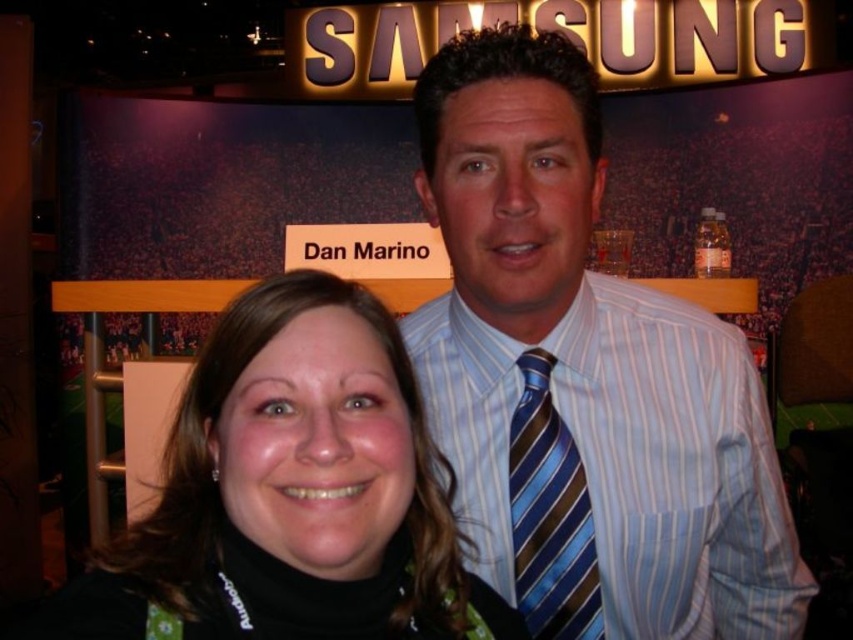
Who is more distant from viewer, (302,292) or (521,433)?

The point (521,433) is behind.

Where is `black matte hair at center`? Image resolution: width=853 pixels, height=640 pixels. black matte hair at center is located at coordinates (293, 492).

What are the coordinates of `black matte hair at center` in the screenshot? It's located at (293, 492).

Is blue striped shirt at center to the left of black matte hair at center from the viewer's perspective?

In fact, blue striped shirt at center is to the right of black matte hair at center.

Does blue striped shirt at center have a larger size compared to black matte hair at center?

Correct, blue striped shirt at center is larger in size than black matte hair at center.

Between point (724, 442) and point (403, 529), which one is positioned behind?

The point (724, 442) is more distant.

You are a GUI agent. You are given a task and a screenshot of the screen. Output one action in this format:
    pyautogui.click(x=<x>, y=<y>)
    Task: Click on the blue striped shirt at center
    The height and width of the screenshot is (640, 853).
    Given the screenshot: What is the action you would take?
    pyautogui.click(x=583, y=378)

Which of these two, blue striped shirt at center or blue striped tie at center, stands taller?

blue striped shirt at center

Can you confirm if blue striped shirt at center is positioned above blue striped tie at center?

Yes.

Find the location of a particular element. blue striped shirt at center is located at coordinates (583, 378).